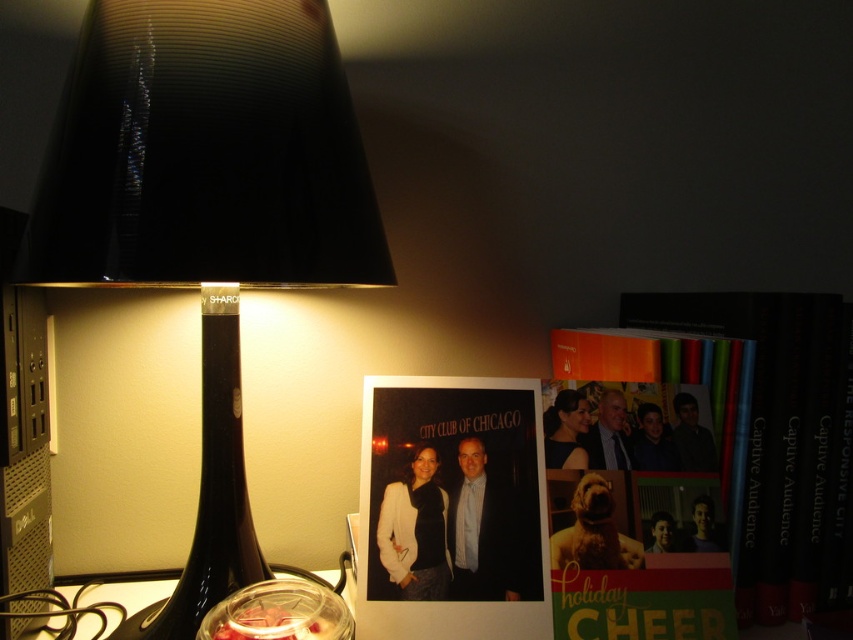
Question: Which point is farther from the camera taking this photo?

Choices:
 (A) (828, 486)
 (B) (730, 406)
 (C) (173, 632)

Answer: (B)

Question: In this image, where is matte paper photo at center located relative to hardcover book at right?

Choices:
 (A) above
 (B) below

Answer: (B)

Question: Which of these objects is positioned closest to the black glass lamp at left?

Choices:
 (A) black glass wine bottle at left
 (B) matte paper photo at center

Answer: (A)

Question: Which point appears farthest from the camera in this image?

Choices:
 (A) (788, 577)
 (B) (583, 516)
 (C) (207, 291)

Answer: (A)

Question: Can you confirm if matte paper photo at center is positioned to the right of black glass wine bottle at left?

Choices:
 (A) yes
 (B) no

Answer: (A)

Question: From the image, what is the correct spatial relationship of matte orange book at center right in relation to hardcover book at right?

Choices:
 (A) below
 (B) above

Answer: (A)